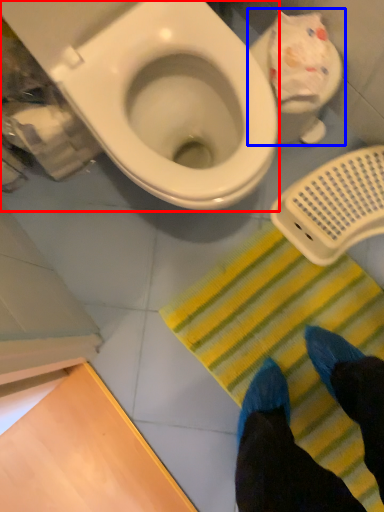
Question: Which point is closer to the camera, toilet (highlighted by a red box) or toilet (highlighted by a blue box)?

Choices:
 (A) toilet
 (B) toilet

Answer: (A)